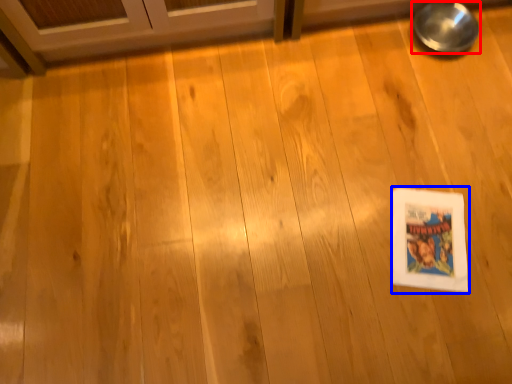
Question: Which of the following is the farthest to the observer, bowl (highlighted by a red box) or comic book (highlighted by a blue box)?

Choices:
 (A) bowl
 (B) comic book

Answer: (A)